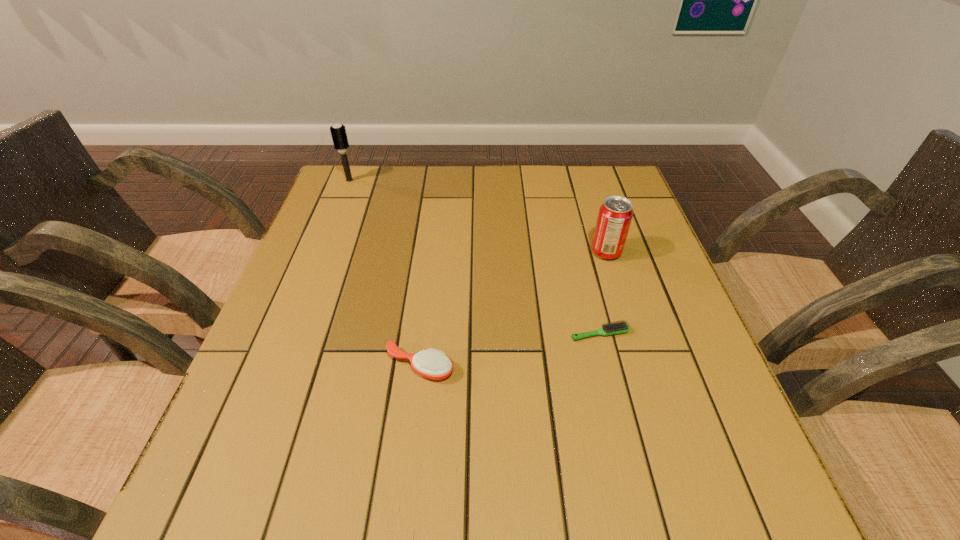
Identify the location of vacant space positioned on the left of the nearest object. (360, 366).

Identify the location of vacant position located 0.370m on the left of the shortest object. (392, 334).

The width and height of the screenshot is (960, 540). In order to click on object that is at the far edge in this screenshot , I will do `click(338, 132)`.

Locate an element on the screen. object present at the left edge is located at coordinates (338, 132).

I want to click on soda located in the right edge section of the desktop, so click(x=615, y=215).

Where is `hairbrush positioned at the right edge`? The image size is (960, 540). hairbrush positioned at the right edge is located at coordinates (x=615, y=328).

You are a GUI agent. You are given a task and a screenshot of the screen. Output one action in this format:
    pyautogui.click(x=<x>, y=<y>)
    Task: Click on the object located at the far left corner
    
    Given the screenshot: What is the action you would take?
    pyautogui.click(x=338, y=132)

Identify the location of free space at the far edge of the desktop. (396, 183).

This screenshot has height=540, width=960. I want to click on vacant space at the near edge of the desktop, so tap(524, 517).

This screenshot has width=960, height=540. Identify the location of free space at the left edge of the desktop. (281, 435).